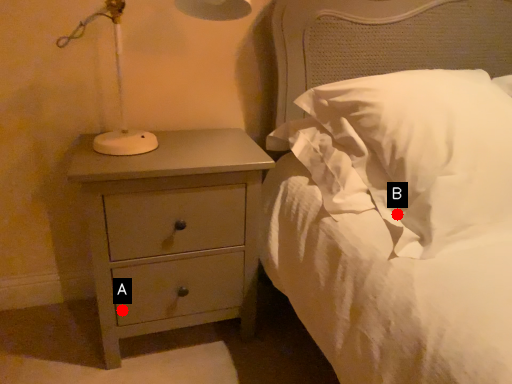
Question: Two points are circled on the image, labeled by A and B beside each circle. Which point is closer to the camera taking this photo?

Choices:
 (A) A is closer
 (B) B is closer

Answer: (B)